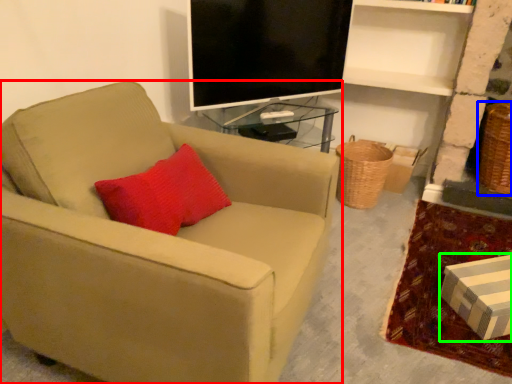
Question: Based on their relative distances, which object is farther from chair (highlighted by a red box)? Choose from basket (highlighted by a blue box) and box (highlighted by a green box).

Choices:
 (A) basket
 (B) box

Answer: (A)